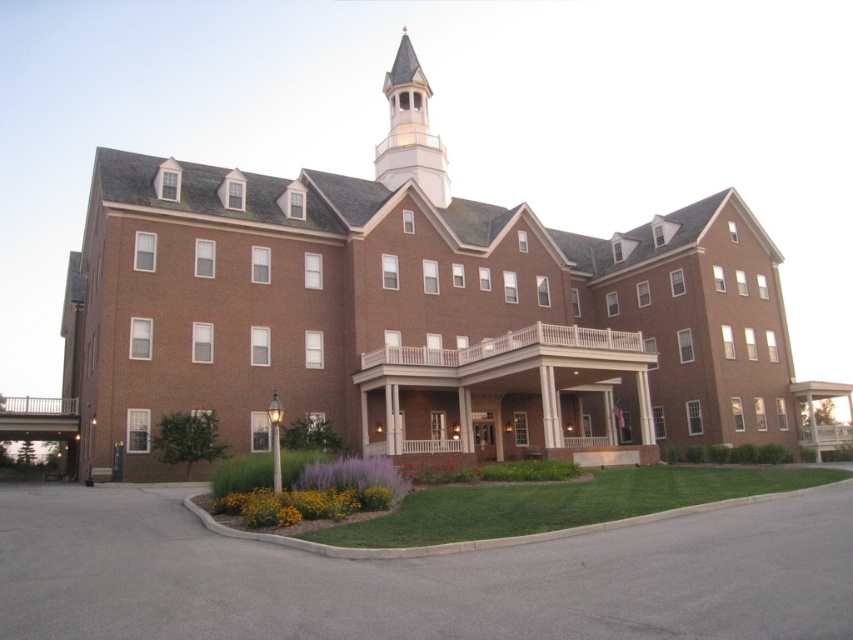
Question: Among these points, which one is nearest to the camera?

Choices:
 (A) (90, 531)
 (B) (300, 499)
 (C) (395, 131)

Answer: (A)

Question: Can you confirm if gray asphalt driveway at lower center is positioned to the left of purple matte flower at center?

Choices:
 (A) no
 (B) yes

Answer: (A)

Question: Which point is farther to the camera?

Choices:
 (A) [x=440, y=157]
 (B) [x=471, y=452]
 (C) [x=125, y=548]

Answer: (A)

Question: Estimate the real-world distances between objects in this image. Which object is farther from the orange textured flowers at lower center?

Choices:
 (A) white wood spire at upper center
 (B) purple matte flower at center
 (C) white wooden porch at center
 (D) brown brick church at center

Answer: (A)

Question: Can you confirm if brown brick church at center is positioned above gray asphalt driveway at lower center?

Choices:
 (A) no
 (B) yes

Answer: (B)

Question: From the image, what is the correct spatial relationship of white wood spire at upper center in relation to orange textured flowers at lower center?

Choices:
 (A) below
 (B) above

Answer: (B)